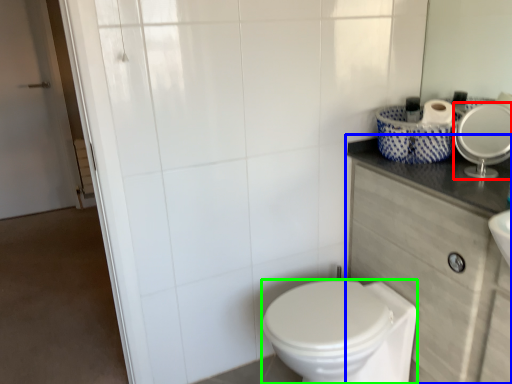
Question: Estimate the real-world distances between objects in this image. Which object is closer to mirror (highlighted by a red box), counter top (highlighted by a blue box) or bidet (highlighted by a green box)?

Choices:
 (A) counter top
 (B) bidet

Answer: (A)